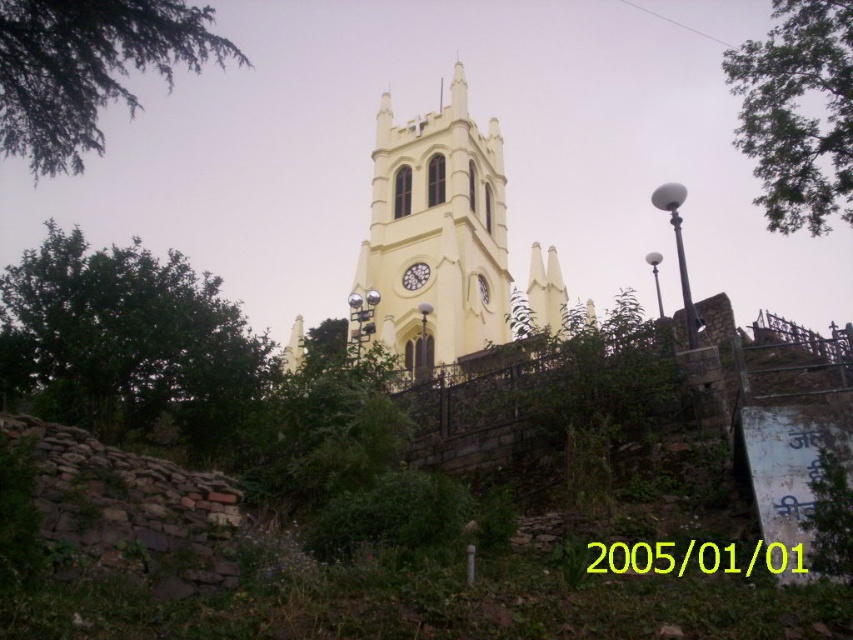
You are standing at the base of the historic church tower and notice two green leafy trees in the scene. Which tree, the green leafy tree at left or the green leafy tree at upper right, is taller?

The green leafy tree at upper right is taller than the green leafy tree at left.

You are standing at point (128, 342) in the image. What object is located at this point?

The green leafy tree at left is located at point (128, 342).

You are standing in front of the historic church tower and notice two green leafy elements in the scene. Which one is wider between the green leafy tree at left and the green leafy branch at upper left?

The green leafy tree at left is wider than the green leafy branch at upper left.